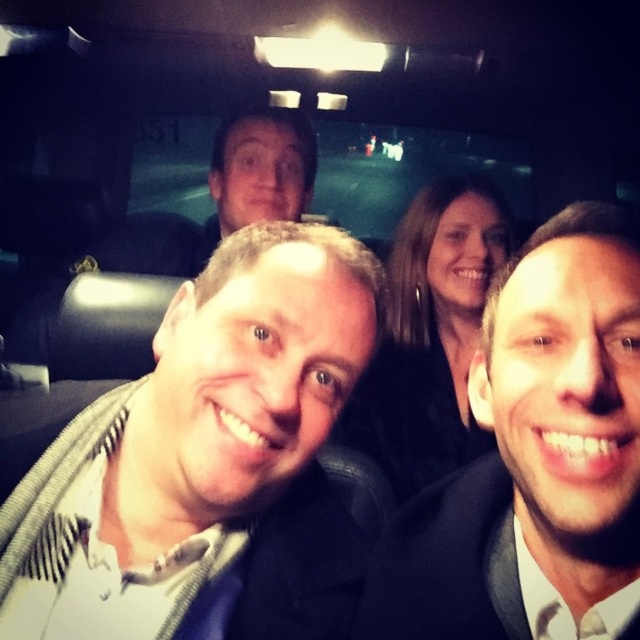
Is point (204, 426) closer to camera compared to point (214, 140)?

Yes.

Is point (19, 628) farther from viewer compared to point (268, 164)?

No, (19, 628) is in front of (268, 164).

The width and height of the screenshot is (640, 640). Identify the location of white textured shirt at center. (189, 451).

Can you confirm if dark brown hair at center is positioned below smooth skin face at upper center?

Indeed, dark brown hair at center is positioned under smooth skin face at upper center.

Who is more distant from viewer, (413, 461) or (250, 124)?

The point (250, 124) is more distant.

The height and width of the screenshot is (640, 640). I want to click on dark brown hair at center, so click(429, 336).

Can you confirm if matte black suit at center is positioned to the right of dark brown hair at center?

Incorrect, matte black suit at center is not on the right side of dark brown hair at center.

Can you confirm if matte black suit at center is positioned above dark brown hair at center?

Actually, matte black suit at center is below dark brown hair at center.

I want to click on matte black suit at center, so click(x=536, y=460).

Find the location of a particular element. This screenshot has height=640, width=640. matte black suit at center is located at coordinates (536, 460).